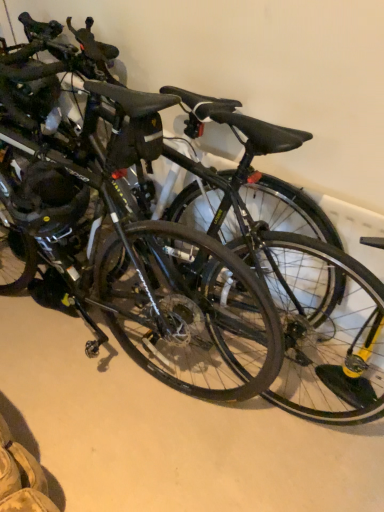
Question: From the image's perspective, is glossy black bicycle at center located above or below matte black helmet at left, which ranks as the first bicycle wheel in left-to-right order?

Choices:
 (A) above
 (B) below

Answer: (A)

Question: Considering their positions, is glossy black bicycle at center located in front of or behind matte black helmet at left, acting as the second bicycle wheel starting from the right?

Choices:
 (A) behind
 (B) front

Answer: (B)

Question: Based on their relative distances, which object is nearer to the black rubber tire at center, acting as the first bicycle wheel starting from the right?

Choices:
 (A) glossy black bicycle at center
 (B) matte black helmet at left, acting as the second bicycle wheel starting from the right
 (C) black matte bicycle at center

Answer: (A)

Question: Estimate the real-world distances between objects in this image. Which object is farther from the black matte bicycle at center?

Choices:
 (A) black rubber tire at center, acting as the 2th bicycle wheel starting from the left
 (B) glossy black bicycle at center
 (C) matte black helmet at left, which ranks as the first bicycle wheel in left-to-right order

Answer: (A)